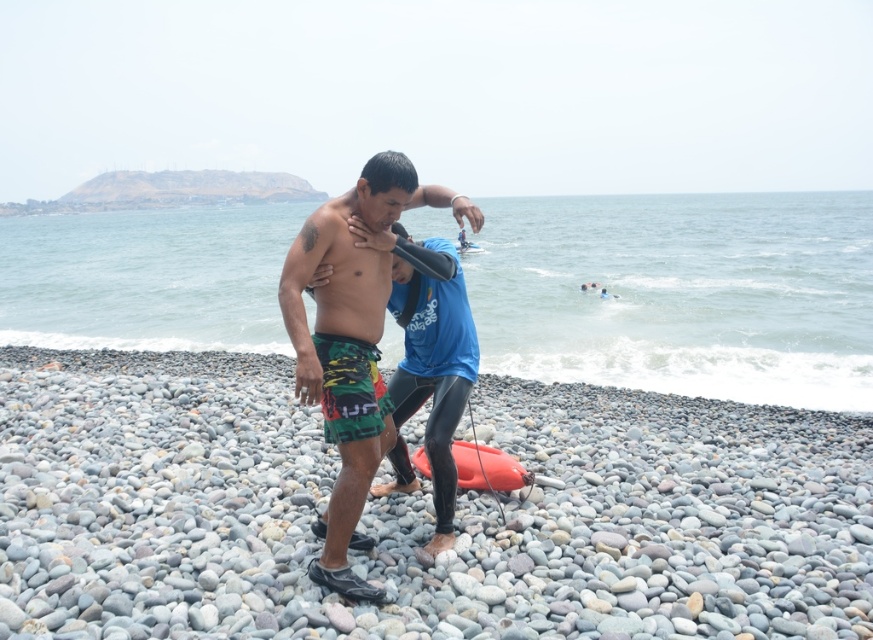
You are a drone operator trying to capture a closeup of the rescue operation. You have two points marked in the image. The first point is at coordinates point (241, 275) and the second point is at point (414, 307). Which point should you focus on to ensure the subject is in front of the other?

Point (414, 307) should be focused on because it is in front of point (241, 275).

You are a lifeguard trying to locate two people on a rocky beach. You see the green patterned shorts at center and the blue rubber wetsuit at center. Which one is on the left side?

The green patterned shorts at center is positioned on the left side of blue rubber wetsuit at center, so the green patterned shorts at center is on the left side.

What are the coordinates of the green patterned shorts at center?

The green patterned shorts at center are located at coordinates point [348,346].